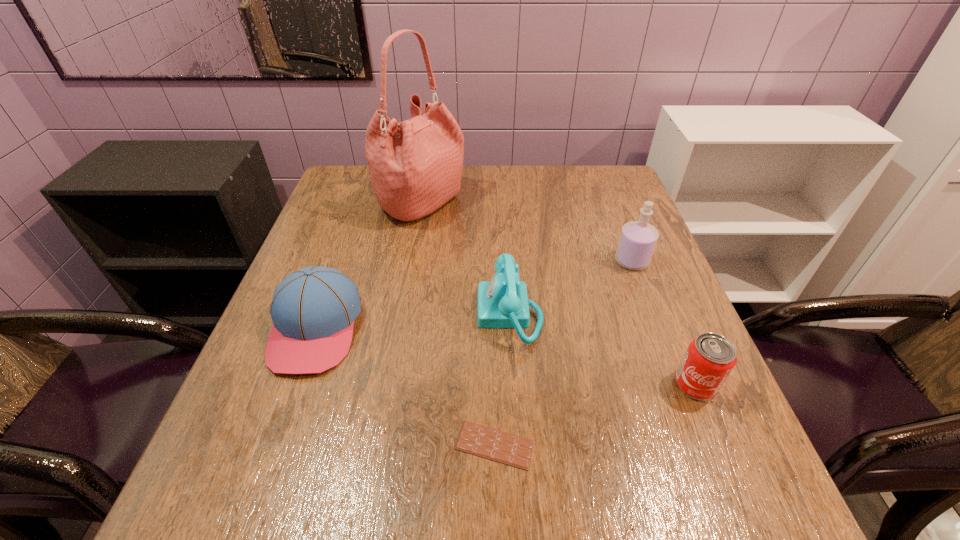
This screenshot has width=960, height=540. I want to click on free point between the telephone and the can, so click(x=603, y=349).

Find the location of a particular element. This screenshot has height=540, width=960. empty space between the chocolate bar and the can is located at coordinates (595, 415).

Identify the location of unoccupied position between the chocolate bar and the perfume. The width and height of the screenshot is (960, 540). (564, 353).

You are a GUI agent. You are given a task and a screenshot of the screen. Output one action in this format:
    pyautogui.click(x=<x>, y=<y>)
    Task: Click on the unoccupied position between the fifth nearest object and the telephone
    This screenshot has width=960, height=540.
    Given the screenshot: What is the action you would take?
    pyautogui.click(x=571, y=287)

The image size is (960, 540). Find the location of `free space between the perfume and the baseball cap`. free space between the perfume and the baseball cap is located at coordinates (473, 295).

Identify the location of vacant area that lies between the handbag and the can. (559, 294).

At what (x,y) coordinates should I click in order to perform the action: click on free space between the perfume and the handbag. Please return your answer as a coordinate pair (x, y). Image resolution: width=960 pixels, height=540 pixels. Looking at the image, I should click on (527, 232).

Identify which object is the nearest to the baseball cap. Please provide its 2D coordinates. Your answer should be formatted as a tuple, i.e. [(x, y)], where the tuple contains the x and y coordinates of a point satisfying the conditions above.

[(415, 166)]

Locate an element on the screen. The image size is (960, 540). object that is the second closest to the can is located at coordinates (638, 239).

I want to click on vacant space that satisfies the following two spatial constraints: 1. on the dial of the telephone; 2. on the front-facing side of the baseball cap, so click(511, 328).